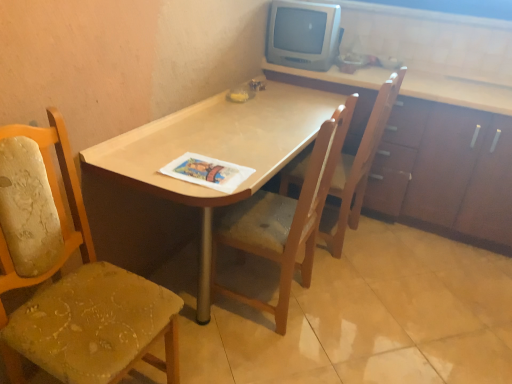
Question: Is light wood desk at center next to worn fabric chair at left, which appears as the 1th chair when viewed from the left, and touching it?

Choices:
 (A) no
 (B) yes

Answer: (A)

Question: Is light wood desk at center to the right of worn fabric chair at left, which is the 3th chair in right-to-left order, from the viewer's perspective?

Choices:
 (A) no
 (B) yes

Answer: (B)

Question: Is light wood desk at center facing towards worn fabric chair at left, which appears as the 1th chair when viewed from the left?

Choices:
 (A) yes
 (B) no

Answer: (B)

Question: Is light wood desk at center positioned behind worn fabric chair at left, which is the 3th chair in right-to-left order?

Choices:
 (A) no
 (B) yes

Answer: (B)

Question: Does light wood desk at center have a smaller size compared to worn fabric chair at left, which appears as the 1th chair when viewed from the left?

Choices:
 (A) yes
 (B) no

Answer: (B)

Question: Is wooden chair at center, which is the 2th chair from left to right, in front of or behind worn fabric chair at left, which appears as the 1th chair when viewed from the left, in the image?

Choices:
 (A) behind
 (B) front

Answer: (A)

Question: From the image's perspective, relative to worn fabric chair at left, which is the 3th chair in right-to-left order, is wooden chair at center, which is the 2th chair from left to right, above or below?

Choices:
 (A) below
 (B) above

Answer: (B)

Question: Considering the positions of wooden chair at center, which is counted as the second chair, starting from the right, and worn fabric chair at left, which appears as the 1th chair when viewed from the left, in the image, is wooden chair at center, which is counted as the second chair, starting from the right, bigger or smaller than worn fabric chair at left, which appears as the 1th chair when viewed from the left,?

Choices:
 (A) big
 (B) small

Answer: (A)

Question: Does point (289, 286) appear closer or farther from the camera than point (22, 347)?

Choices:
 (A) closer
 (B) farther

Answer: (B)

Question: Considering the positions of worn fabric chair at left, which is the 3th chair in right-to-left order, and printed paper magazine at center in the image, is worn fabric chair at left, which is the 3th chair in right-to-left order, taller or shorter than printed paper magazine at center?

Choices:
 (A) short
 (B) tall

Answer: (B)

Question: From a real-world perspective, is worn fabric chair at left, which is the 3th chair in right-to-left order, physically located above or below printed paper magazine at center?

Choices:
 (A) above
 (B) below

Answer: (B)

Question: Would you say worn fabric chair at left, which appears as the 1th chair when viewed from the left, is to the left or to the right of printed paper magazine at center in the picture?

Choices:
 (A) right
 (B) left

Answer: (B)

Question: Considering their positions, is worn fabric chair at left, which appears as the 1th chair when viewed from the left, located in front of or behind printed paper magazine at center?

Choices:
 (A) front
 (B) behind

Answer: (A)

Question: From a real-world perspective, is wooden cabinet at upper right positioned above or below wooden chair at center, placed as the 1th chair when sorted from right to left?

Choices:
 (A) below
 (B) above

Answer: (A)

Question: Considering the positions of wooden cabinet at upper right and wooden chair at center, placed as the 1th chair when sorted from right to left, in the image, is wooden cabinet at upper right bigger or smaller than wooden chair at center, placed as the 1th chair when sorted from right to left,?

Choices:
 (A) big
 (B) small

Answer: (A)